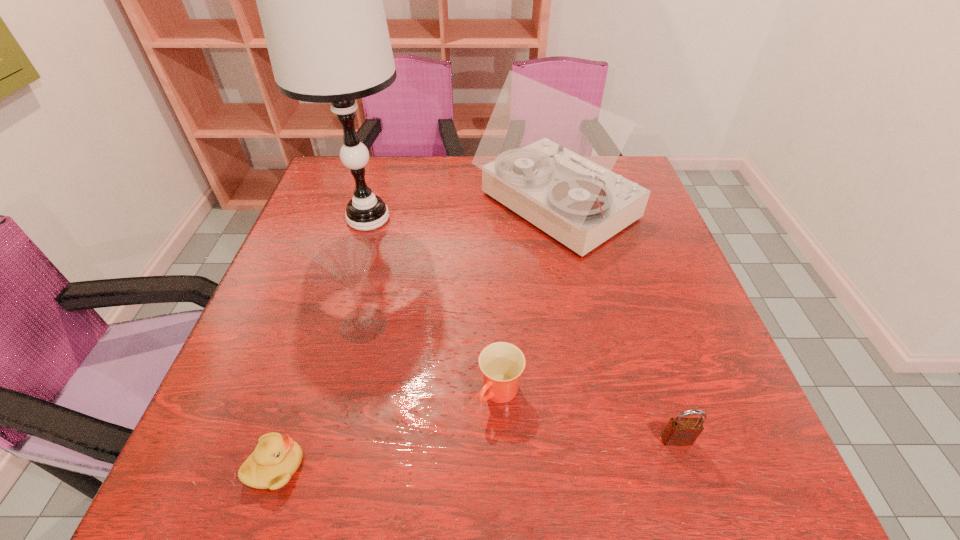
Identify the location of object that is positioned at the far left corner. (320, 0).

This screenshot has width=960, height=540. In order to click on object that is at the near left corner in this screenshot , I will do `click(276, 458)`.

Image resolution: width=960 pixels, height=540 pixels. I want to click on object that is at the far right corner, so coord(546,155).

In order to click on object that is at the near right corner in this screenshot , I will do [x=679, y=431].

At what (x,y) coordinates should I click in order to perform the action: click on vacant space at the far edge of the desktop. Please return your answer as a coordinate pair (x, y). Looking at the image, I should click on (385, 163).

In the image, there is a desktop. Where is `vacant space at the near edge`? vacant space at the near edge is located at coordinates (618, 488).

You are a GUI agent. You are given a task and a screenshot of the screen. Output one action in this format:
    pyautogui.click(x=<x>, y=<y>)
    Task: Click on the free region at the left edge of the desktop
    
    Given the screenshot: What is the action you would take?
    [296, 334]

The image size is (960, 540). What are the coordinates of `vacant region at the right edge of the desktop` in the screenshot? It's located at (660, 291).

In the image, there is a desktop. At what (x,y) coordinates should I click in order to perform the action: click on vacant space at the far left corner. Please return your answer as a coordinate pair (x, y). Looking at the image, I should click on (335, 195).

At what (x,y) coordinates should I click in order to perform the action: click on vacant space at the near left corner of the desktop. Please return your answer as a coordinate pair (x, y). This screenshot has height=540, width=960. Looking at the image, I should click on (180, 478).